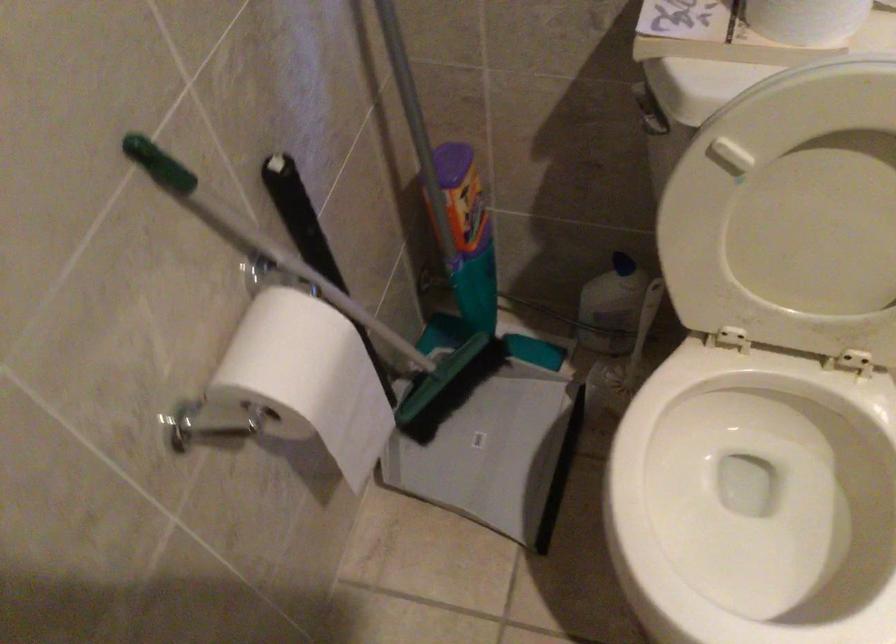
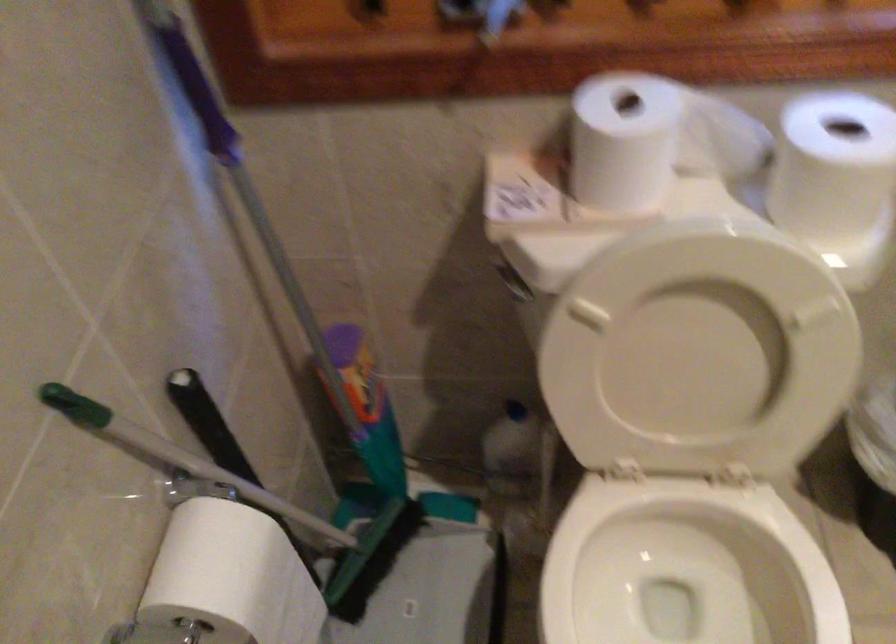
Question: What movement of the cameraman would produce the second image?

Choices:
 (A) Left
 (B) Right
 (C) Forward
 (D) Backward

Answer: (D)